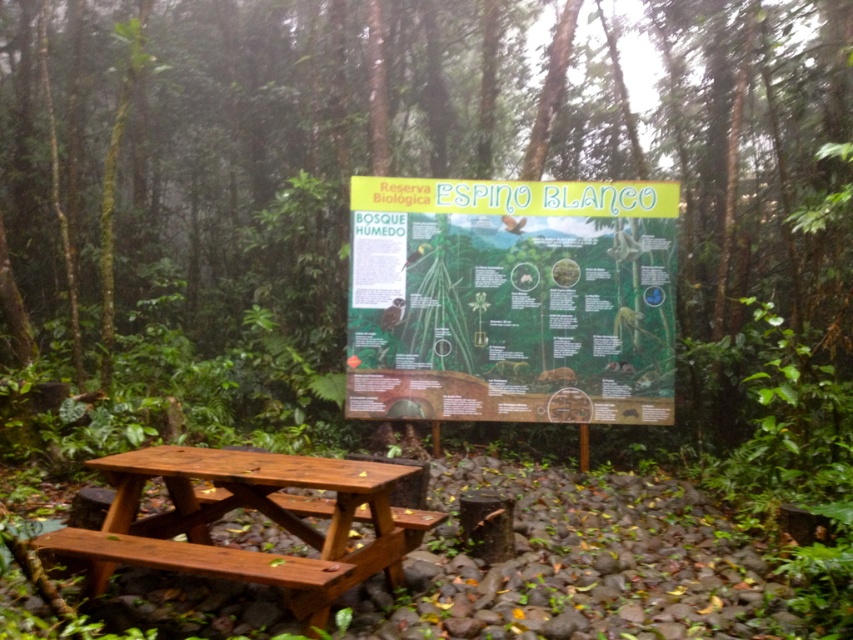
Question: Which point is closer to the camera taking this photo?

Choices:
 (A) (225, 566)
 (B) (355, 220)

Answer: (A)

Question: Can you confirm if brown wooden sign at center is wider than polished wood picnic table at center?

Choices:
 (A) no
 (B) yes

Answer: (B)

Question: Which of the following is the closest to the observer?

Choices:
 (A) (187, 490)
 (B) (717, 172)

Answer: (A)

Question: Can you confirm if brown wooden sign at center is positioned to the right of polished wood picnic table at center?

Choices:
 (A) yes
 (B) no

Answer: (A)

Question: Is brown wooden sign at center bigger than matte green board at center?

Choices:
 (A) no
 (B) yes

Answer: (B)

Question: Which of these objects is positioned farthest from the brown wooden sign at center?

Choices:
 (A) matte green board at center
 (B) polished wood picnic table at center

Answer: (B)